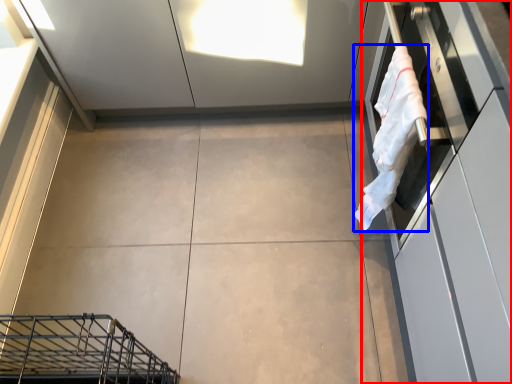
Question: Which of the following is the farthest to the observer, cabinetry (highlighted by a red box) or laundry (highlighted by a blue box)?

Choices:
 (A) cabinetry
 (B) laundry

Answer: (B)